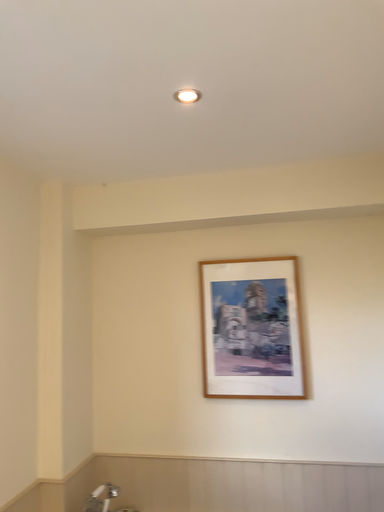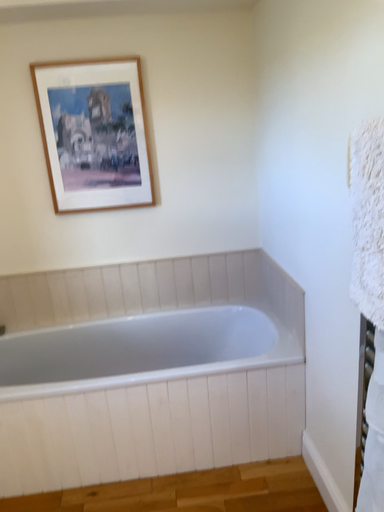
Question: How did the camera likely rotate when shooting the video?

Choices:
 (A) rotated downward
 (B) rotated upward

Answer: (A)